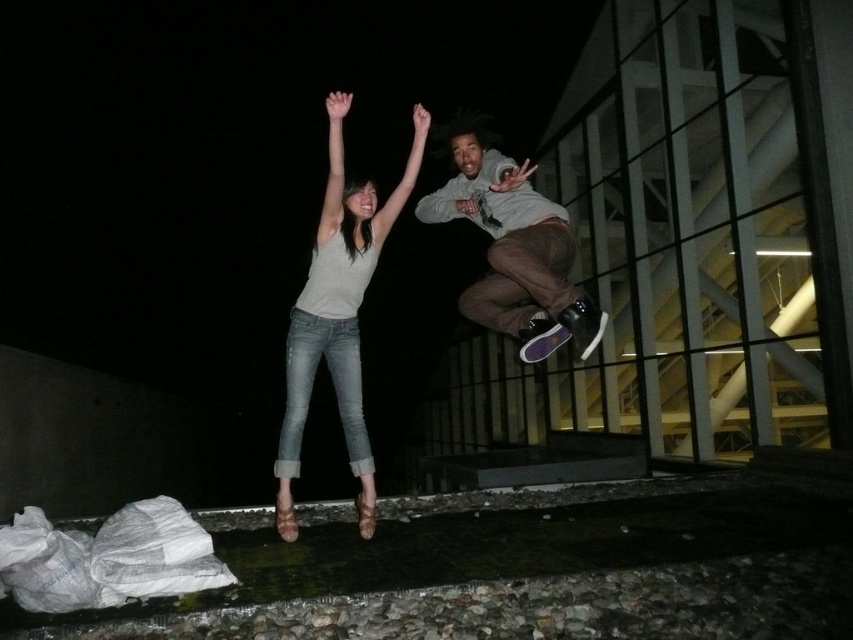
Question: Which object is the farthest from the matte gray hoodie at center?

Choices:
 (A) denim jeans at center
 (B) matte gray shirt at center

Answer: (A)

Question: Does denim jeans at center have a greater width compared to matte gray hoodie at center?

Choices:
 (A) yes
 (B) no

Answer: (B)

Question: Does matte gray shirt at center come in front of matte gray hoodie at center?

Choices:
 (A) no
 (B) yes

Answer: (A)

Question: Can you confirm if denim jeans at center is smaller than matte gray hoodie at center?

Choices:
 (A) no
 (B) yes

Answer: (B)

Question: Which of the following is the closest to the observer?

Choices:
 (A) (486, 285)
 (B) (334, 164)

Answer: (B)

Question: Which object appears farthest from the camera in this image?

Choices:
 (A) matte gray shirt at center
 (B) denim jeans at center
 (C) matte gray hoodie at center

Answer: (B)